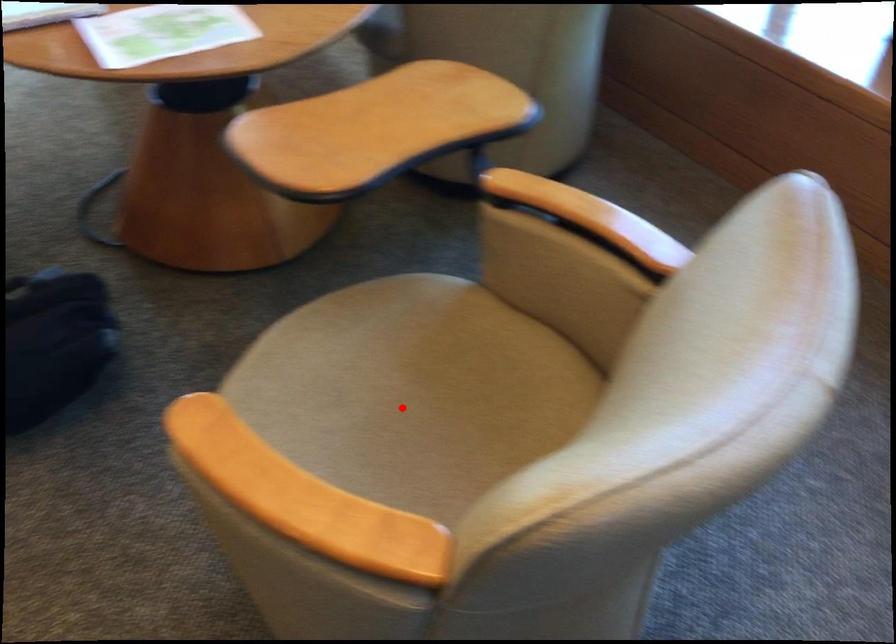
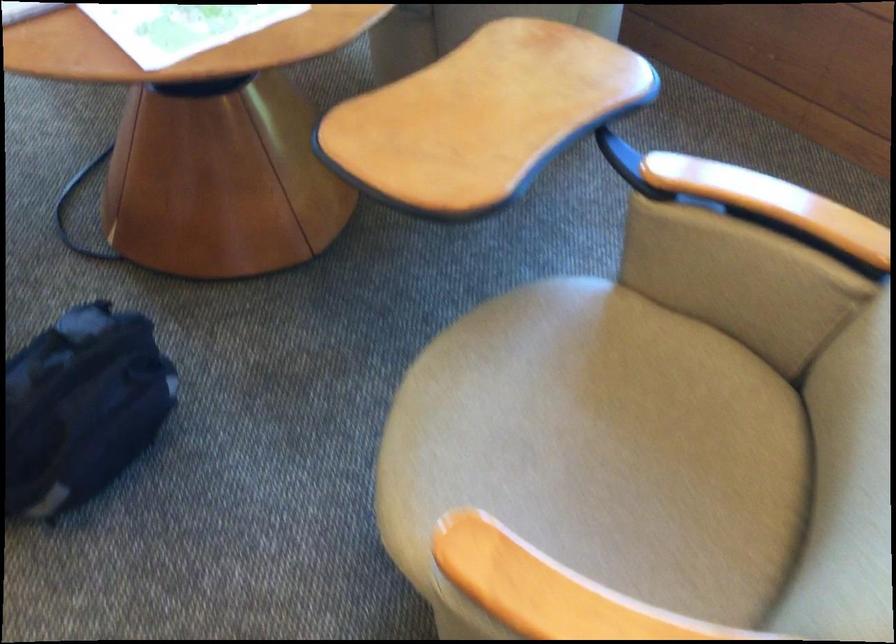
In the second image, find the point that corresponds to the highlighted location in the first image.

(602, 448)